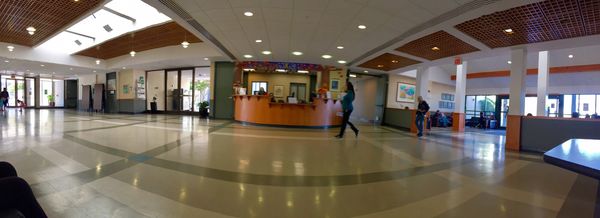
What are the coordinates of `recessed lighting` in the screenshot? It's located at (361, 29), (250, 18), (259, 39), (269, 49), (293, 53), (327, 55), (42, 67).